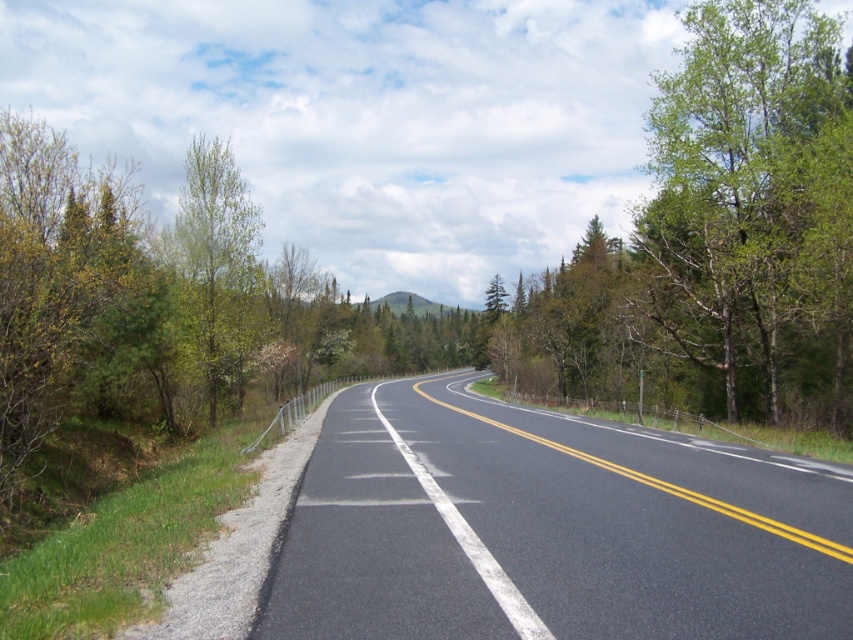
Looking at this image, is black asphalt road at center positioned at the back of green leafy tree at left?

That is False.

Measure the distance between black asphalt road at center and green leafy tree at left.

The distance of black asphalt road at center from green leafy tree at left is 25.39 meters.

Which is behind, point (477, 444) or point (206, 358)?

Positioned behind is point (206, 358).

Locate an element on the screen. black asphalt road at center is located at coordinates (549, 529).

Is black asphalt road at center thinner than green leafy tree at right?

Correct, black asphalt road at center's width is less than green leafy tree at right's.

At what (x,y) coordinates should I click in order to perform the action: click on black asphalt road at center. Please return your answer as a coordinate pair (x, y). Looking at the image, I should click on (549, 529).

Identify the location of black asphalt road at center. (549, 529).

Between green leafy tree at right and green leafy tree at left, which one is positioned higher?

green leafy tree at right is higher up.

Does green leafy tree at right appear on the right side of green leafy tree at left?

Correct, you'll find green leafy tree at right to the right of green leafy tree at left.

Identify the location of green leafy tree at right. (755, 204).